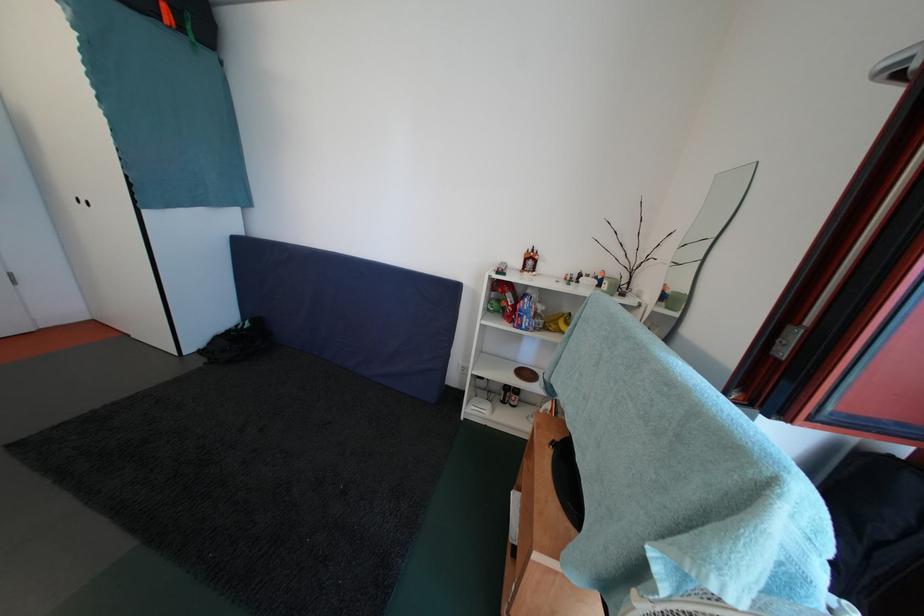
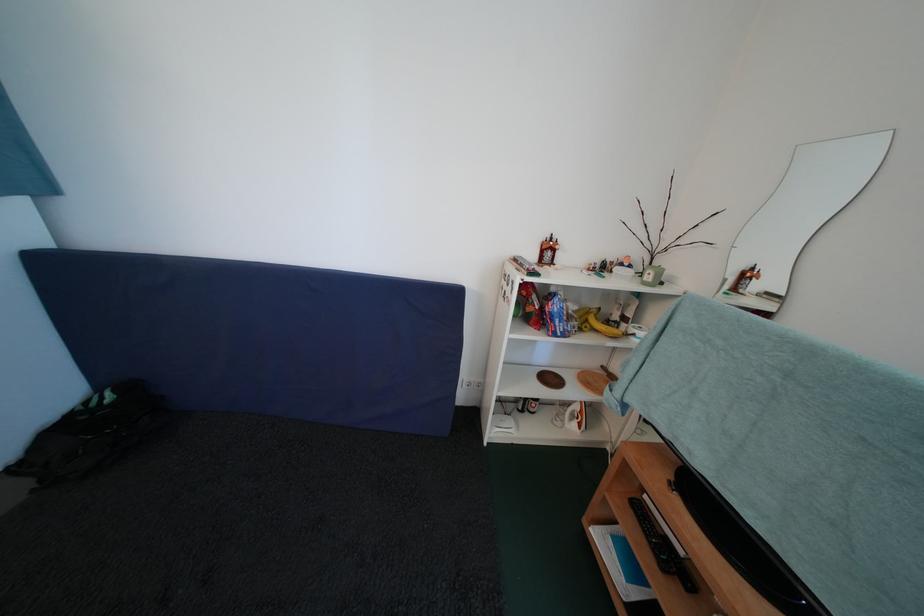
Where in the second image is the point corresponding to [532,322] from the first image?

(565, 326)